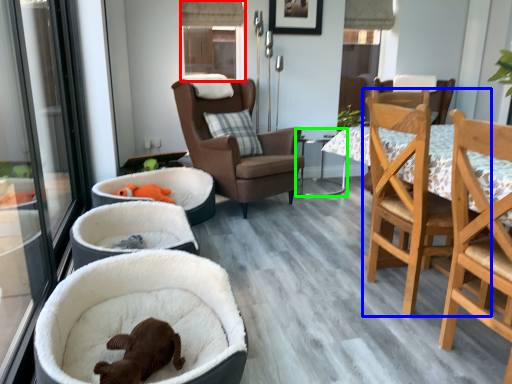
Question: Which object is positioned farthest from window (highlighted by a red box)? Select from chair (highlighted by a blue box) and table (highlighted by a green box).

Choices:
 (A) chair
 (B) table

Answer: (A)